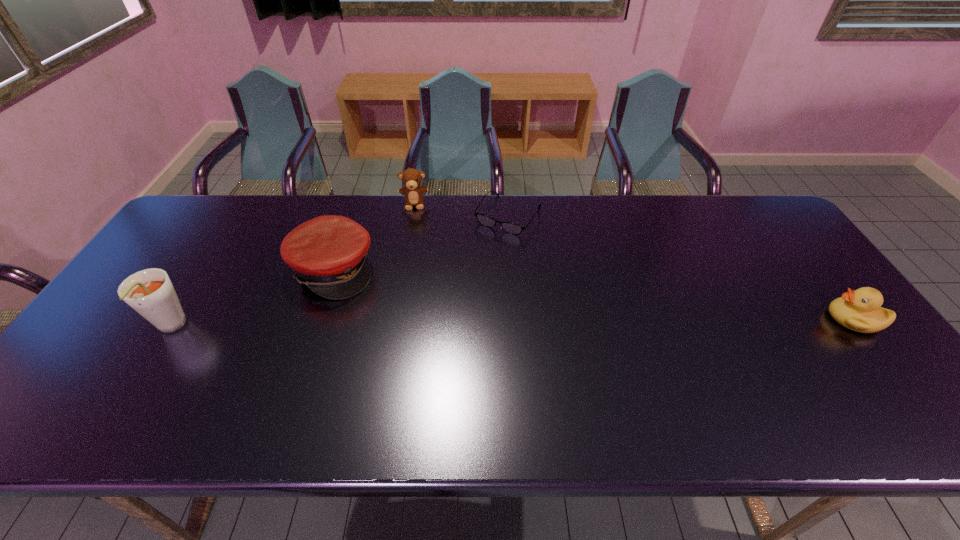
Identify the location of vacant space that satisfies the following two spatial constraints: 1. on the front side of the rightmost object; 2. on the beak of the third object from right to left. This screenshot has height=540, width=960. (394, 319).

You are a GUI agent. You are given a task and a screenshot of the screen. Output one action in this format:
    pyautogui.click(x=<x>, y=<y>)
    Task: Click on the vacant space that satisfies the following two spatial constraints: 1. on the back side of the second object from left to right; 2. on the right side of the spectacles
    Image resolution: width=960 pixels, height=540 pixels.
    Given the screenshot: What is the action you would take?
    pyautogui.click(x=351, y=216)